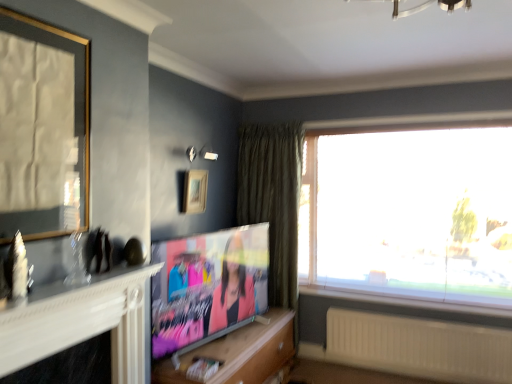
Find the location of `vacant location behind matte paper magazine at lower center`. vacant location behind matte paper magazine at lower center is located at coordinates (207, 363).